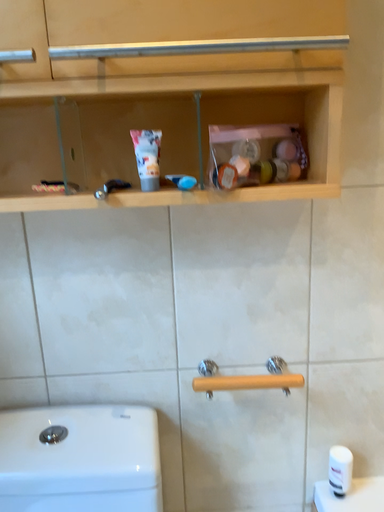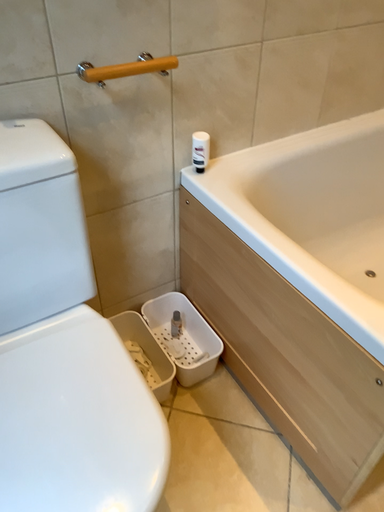
Question: Which way did the camera rotate in the video?

Choices:
 (A) rotated left
 (B) rotated right

Answer: (B)